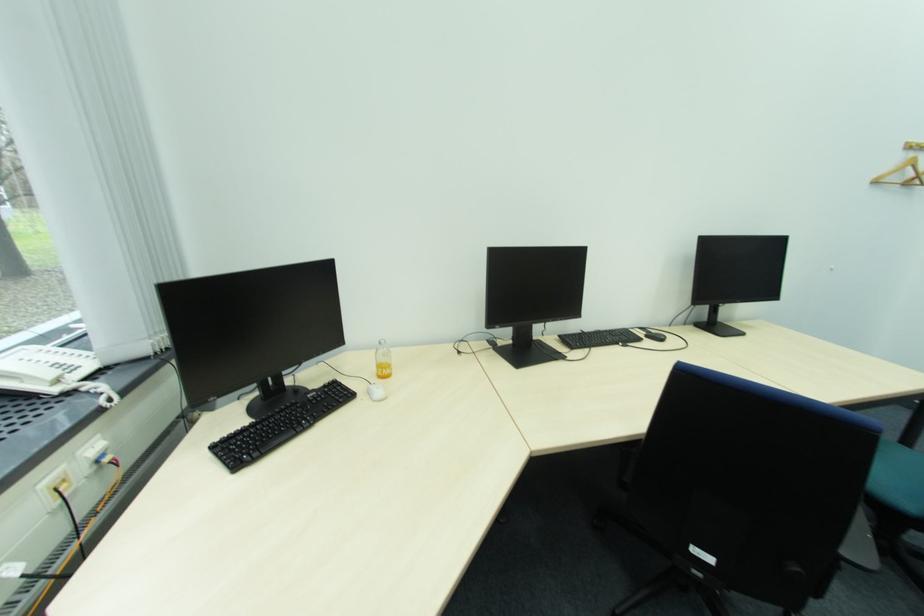
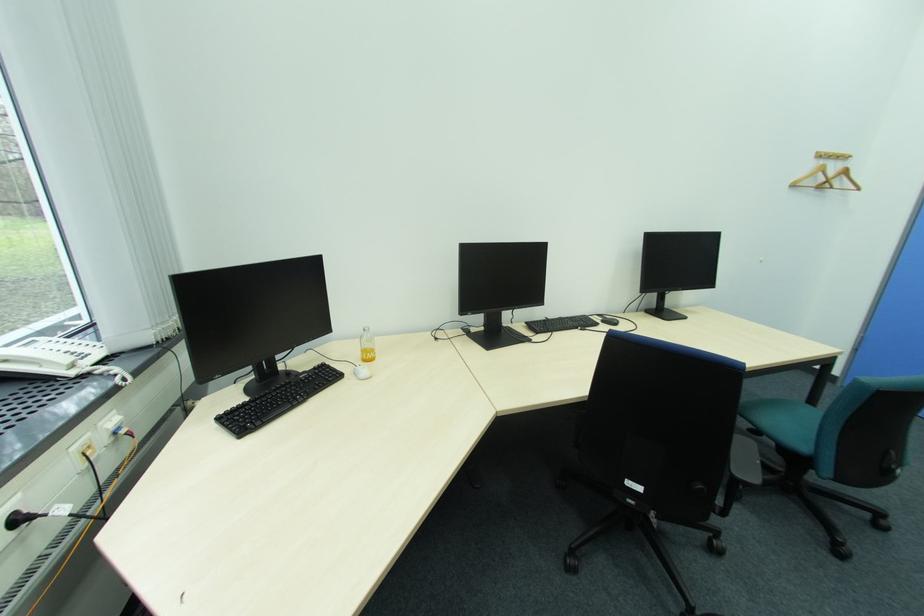
Locate, in the second image, the point that corresponds to the point at 387,367 in the first image.

(371, 352)